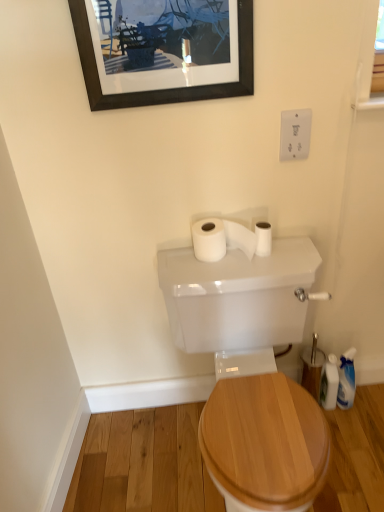
Where is `vacant area that is in front of white plastic bottle at lower right`? vacant area that is in front of white plastic bottle at lower right is located at coordinates (351, 438).